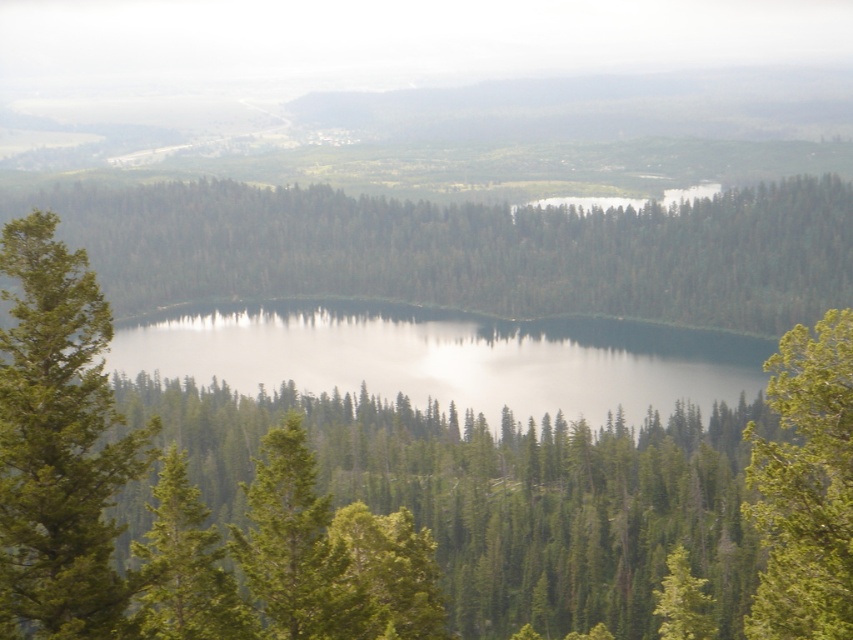
Question: Based on their relative distances, which object is farther from the shiny dark blue water at center?

Choices:
 (A) green textured tree at center
 (B) green leafy tree at right

Answer: (A)

Question: Estimate the real-world distances between objects in this image. Which object is closer to the green textured tree at center?

Choices:
 (A) green leafy tree at right
 (B) green matte tree at center

Answer: (A)

Question: Can you confirm if shiny dark blue water at center is wider than green textured tree at center?

Choices:
 (A) yes
 (B) no

Answer: (A)

Question: Where is shiny dark blue water at center located in relation to green textured tree at lower left in the image?

Choices:
 (A) right
 (B) left

Answer: (A)

Question: Can you confirm if green textured tree at center is thinner than green textured tree at lower left?

Choices:
 (A) yes
 (B) no

Answer: (A)

Question: Which point is farther to the camera?

Choices:
 (A) (836, 406)
 (B) (300, 552)
 (C) (550, 218)

Answer: (C)